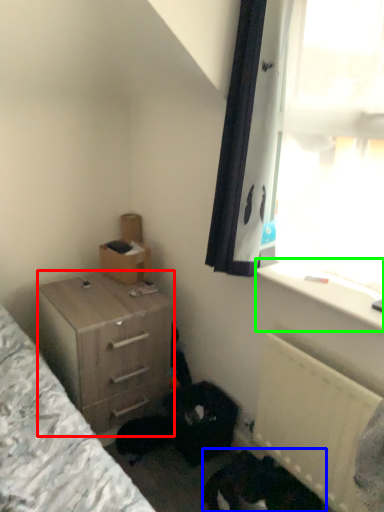
Question: Considering the real-world distances, which object is farthest from chest of drawers (highlighted by a red box)? animal (highlighted by a blue box) or window sill (highlighted by a green box)?

Choices:
 (A) animal
 (B) window sill

Answer: (B)